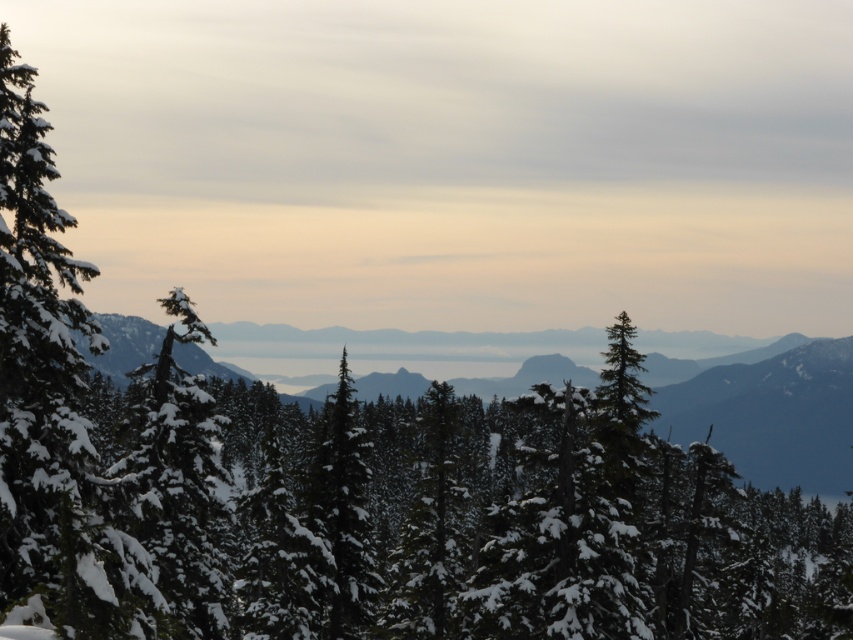
Question: Does snow-covered evergreen at left have a lesser width compared to green matte tree at center?

Choices:
 (A) no
 (B) yes

Answer: (A)

Question: Which object appears farthest from the camera in this image?

Choices:
 (A) green matte tree at center
 (B) snow-covered evergreen at left

Answer: (A)

Question: Is snow-covered evergreen at left to the right of green matte tree at center from the viewer's perspective?

Choices:
 (A) yes
 (B) no

Answer: (B)

Question: Does snow-covered evergreen at left have a larger size compared to green matte tree at center?

Choices:
 (A) yes
 (B) no

Answer: (A)

Question: Which point is farther to the camera?

Choices:
 (A) green matte tree at center
 (B) snow-covered evergreen at left

Answer: (A)